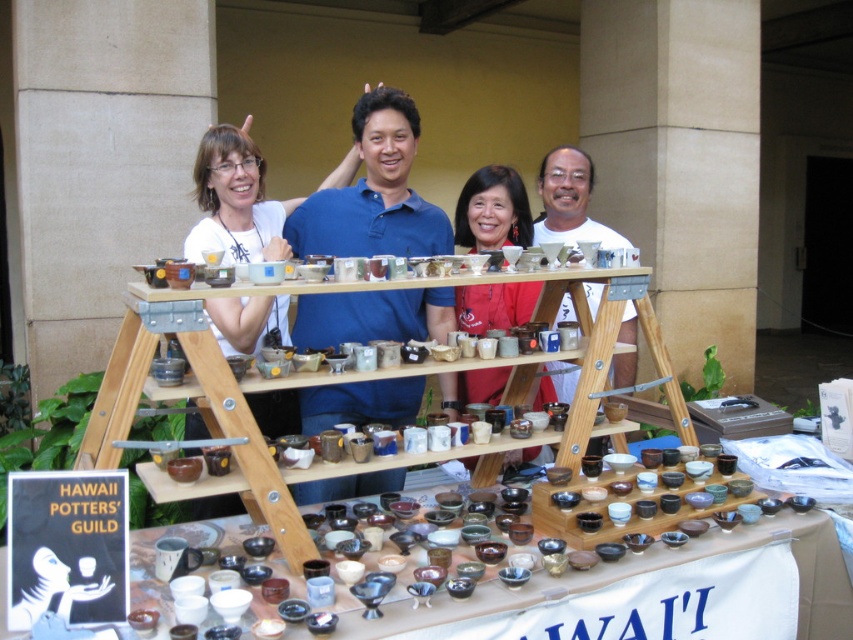
You are taking a photo of the Hawaii Potters Guild members and their pottery display. You want to focus on the member at point (x=430, y=368) and the member at point (x=495, y=211). Which member is closer to the camera?

The member at point (x=430, y=368) is closer to the camera than the member at point (x=495, y=211).

You are a customer at the Hawaii Potters Guild booth and want to pick up the matte ceramic bowl at center. However, there are matte ceramic bowls at center blocking your view. Which one should you move first to access the one you want?

The matte ceramic bowl at center is located above the matte ceramic bowls at center, so you should move the matte ceramic bowls at center first to access the one above.

You are setting up a display for the Hawaii Potters Guild. You have a wooden shelves at center and a matte ceramic bowl at center. Which object has a greater width?

The wooden shelves at center has a greater width than the matte ceramic bowl at center.